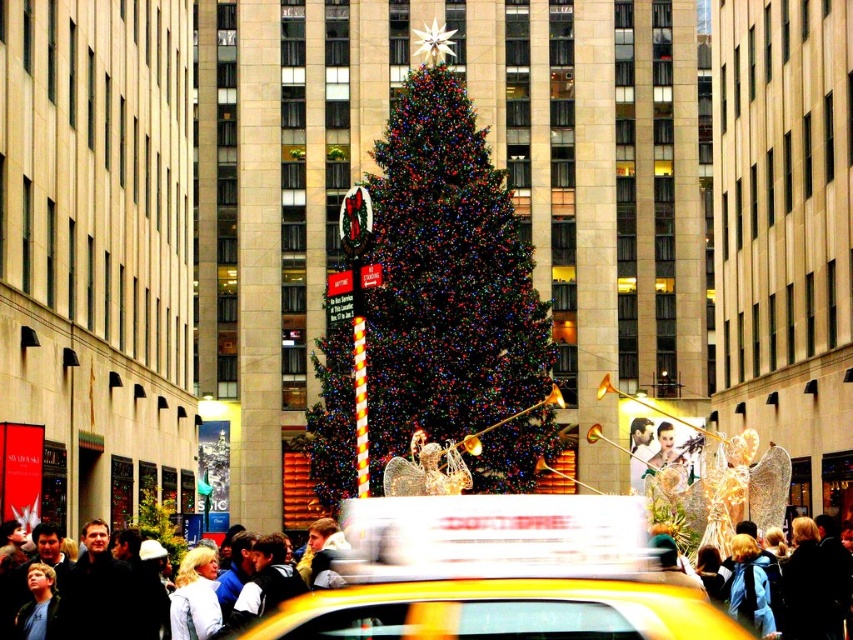
Question: Does green matte christmas tree at center have a lesser width compared to yellow plastic taxi at center?

Choices:
 (A) yes
 (B) no

Answer: (B)

Question: Which object is farther from the camera taking this photo?

Choices:
 (A) green matte christmas tree at center
 (B) yellow plastic taxi at center
 (C) light blue denim jacket at lower left

Answer: (A)

Question: Considering the relative positions of green matte christmas tree at center and light blue denim jacket at lower left in the image provided, where is green matte christmas tree at center located with respect to light blue denim jacket at lower left?

Choices:
 (A) below
 (B) above

Answer: (B)

Question: Does yellow plastic taxi at center have a greater width compared to light blue denim jacket at lower left?

Choices:
 (A) no
 (B) yes

Answer: (B)

Question: Which of these objects is positioned closest to the yellow plastic taxi at center?

Choices:
 (A) green matte christmas tree at center
 (B) light blue denim jacket at lower left

Answer: (B)

Question: Which of the following is the farthest from the observer?

Choices:
 (A) (432, 273)
 (B) (521, 595)

Answer: (A)